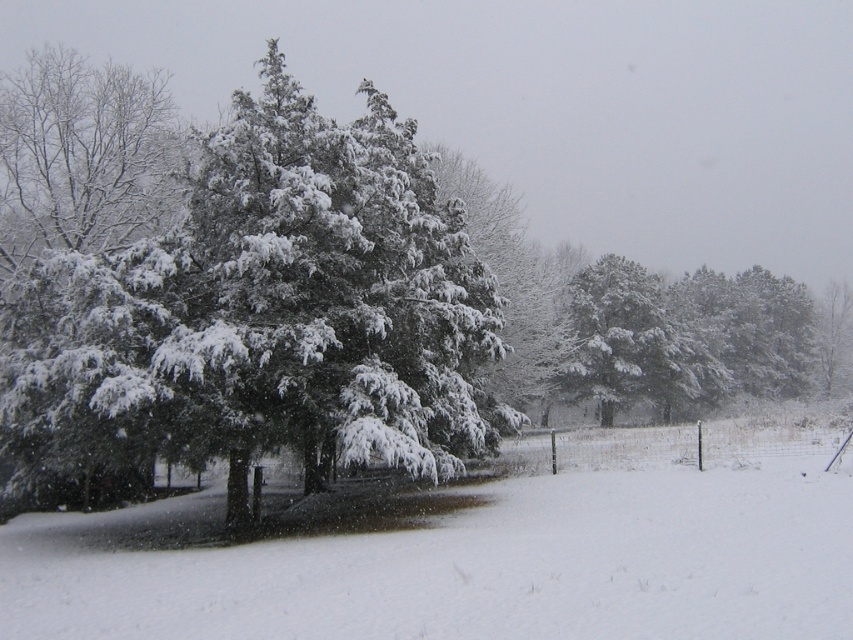
Question: Which object is the farthest from the white fluffy snow at center?

Choices:
 (A) snow-covered evergreen at center
 (B) green matte tree at center

Answer: (A)

Question: Can you confirm if green matte tree at center is bigger than white fluffy snow at center?

Choices:
 (A) yes
 (B) no

Answer: (A)

Question: Which is nearer to the white fluffy snow at center?

Choices:
 (A) snow-covered evergreen at center
 (B) green matte tree at center

Answer: (B)

Question: Which point is farther to the camera?

Choices:
 (A) green matte tree at center
 (B) snow-covered evergreen at center

Answer: (B)

Question: From the image, what is the correct spatial relationship of green matte tree at center in relation to white fluffy snow at center?

Choices:
 (A) right
 (B) left

Answer: (B)

Question: Can you confirm if green matte tree at center is positioned above snow-covered evergreen at center?

Choices:
 (A) no
 (B) yes

Answer: (A)